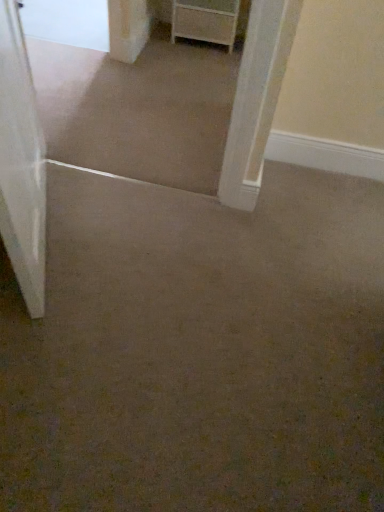
Question: Considering the relative positions of white matte chest of drawers at upper center and white matte door at left in the image provided, is white matte chest of drawers at upper center to the left or to the right of white matte door at left?

Choices:
 (A) left
 (B) right

Answer: (B)

Question: Is white matte chest of drawers at upper center inside the boundaries of white matte door at left, or outside?

Choices:
 (A) inside
 (B) outside

Answer: (B)

Question: Is white matte chest of drawers at upper center wider or thinner than white matte door at left?

Choices:
 (A) wide
 (B) thin

Answer: (A)

Question: Based on their sizes in the image, would you say white matte door at left is bigger or smaller than white matte chest of drawers at upper center?

Choices:
 (A) small
 (B) big

Answer: (B)

Question: Is point (13, 59) closer or farther from the camera than point (201, 4)?

Choices:
 (A) farther
 (B) closer

Answer: (B)

Question: From a real-world perspective, is white matte door at left positioned above or below white matte chest of drawers at upper center?

Choices:
 (A) below
 (B) above

Answer: (B)

Question: Which is correct: white matte door at left is inside white matte chest of drawers at upper center, or outside of it?

Choices:
 (A) outside
 (B) inside

Answer: (A)